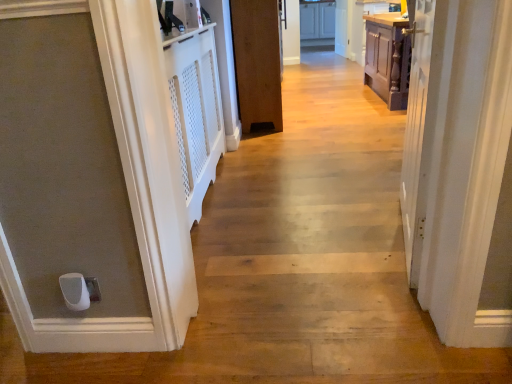
Question: Can we say white glossy cabinets at upper center lies outside brown wood door at center?

Choices:
 (A) no
 (B) yes

Answer: (B)

Question: Can you confirm if white glossy cabinets at upper center is positioned to the right of brown wood door at center?

Choices:
 (A) no
 (B) yes

Answer: (B)

Question: Are white glossy cabinets at upper center and brown wood door at center located far from each other?

Choices:
 (A) no
 (B) yes

Answer: (B)

Question: Is white glossy cabinets at upper center oriented towards brown wood door at center?

Choices:
 (A) no
 (B) yes

Answer: (B)

Question: Is white glossy cabinets at upper center positioned with its back to brown wood door at center?

Choices:
 (A) no
 (B) yes

Answer: (A)

Question: Is white glossy cabinets at upper center smaller than brown wood door at center?

Choices:
 (A) no
 (B) yes

Answer: (B)

Question: Does brown wood door at center have a greater width compared to white glossy cabinets at upper center?

Choices:
 (A) no
 (B) yes

Answer: (A)

Question: Is brown wood door at center behind white glossy cabinets at upper center?

Choices:
 (A) no
 (B) yes

Answer: (A)

Question: Does brown wood door at center touch white glossy cabinets at upper center?

Choices:
 (A) no
 (B) yes

Answer: (A)

Question: Can you confirm if brown wood door at center is shorter than white glossy cabinets at upper center?

Choices:
 (A) no
 (B) yes

Answer: (A)

Question: Can you confirm if brown wood door at center is thinner than white glossy cabinets at upper center?

Choices:
 (A) yes
 (B) no

Answer: (A)

Question: Does brown wood door at center have a larger size compared to white glossy cabinets at upper center?

Choices:
 (A) yes
 (B) no

Answer: (A)

Question: Is point (302, 18) closer or farther from the camera than point (246, 54)?

Choices:
 (A) farther
 (B) closer

Answer: (A)